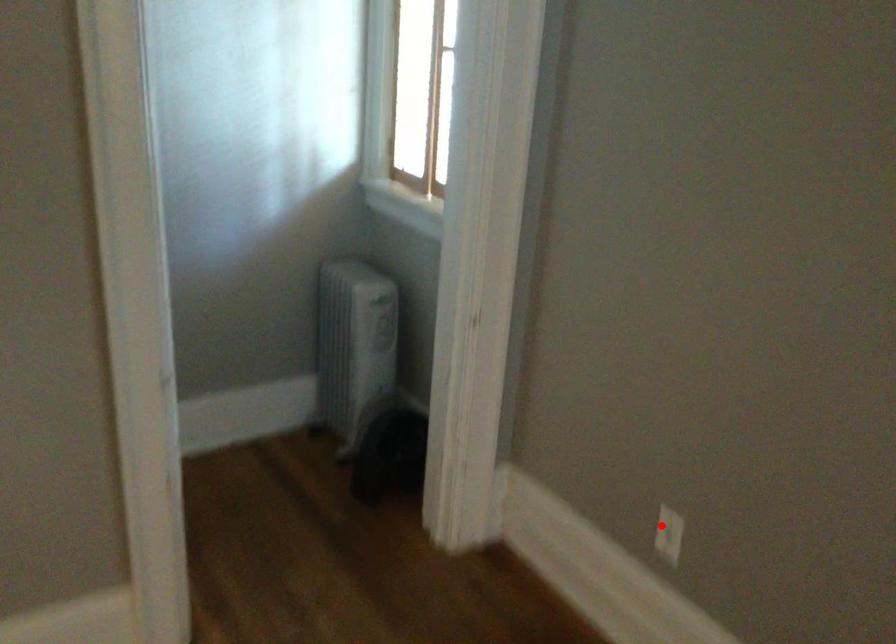
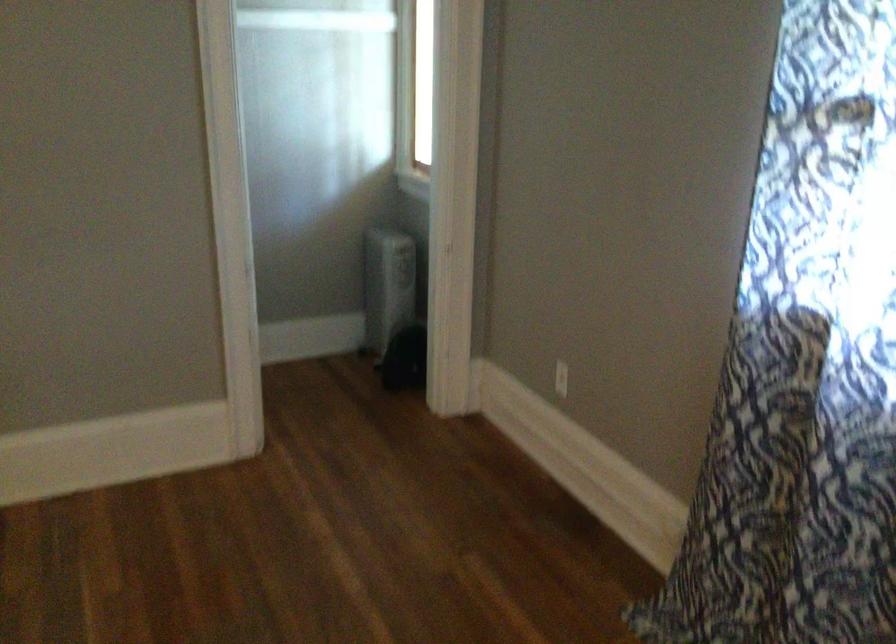
Question: I am providing you with two images of the same scene from different viewpoints. Image1 has a red point marked. In image2, the corresponding 3D location appears at what relative position? Reply with the corresponding letter.

Choices:
 (A) Closer
 (B) Farther

Answer: (B)